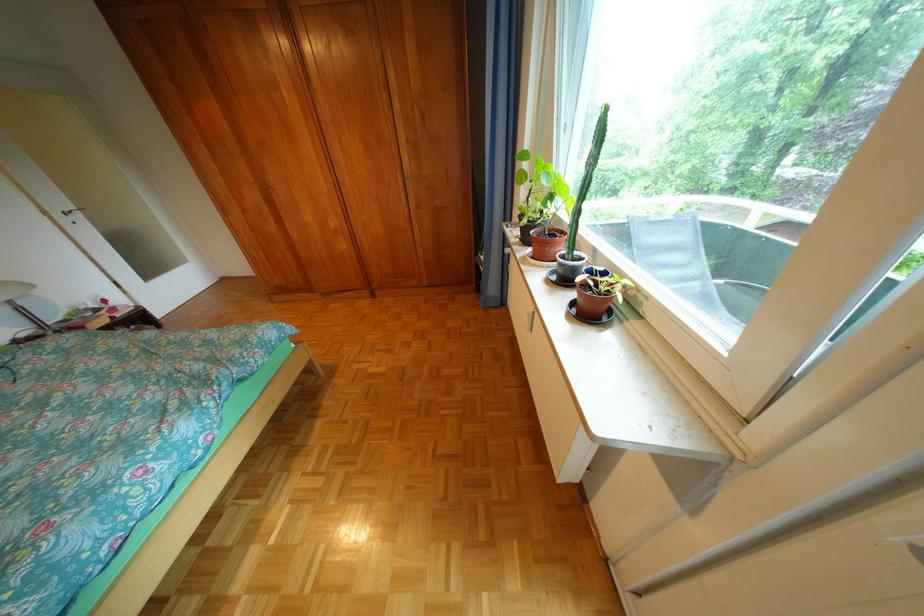
You are a GUI agent. You are given a task and a screenshot of the screen. Output one action in this format:
    pyautogui.click(x=<x>, y=<y>)
    Task: Click on the small plant pot
    
    Given the screenshot: What is the action you would take?
    pyautogui.click(x=546, y=243)